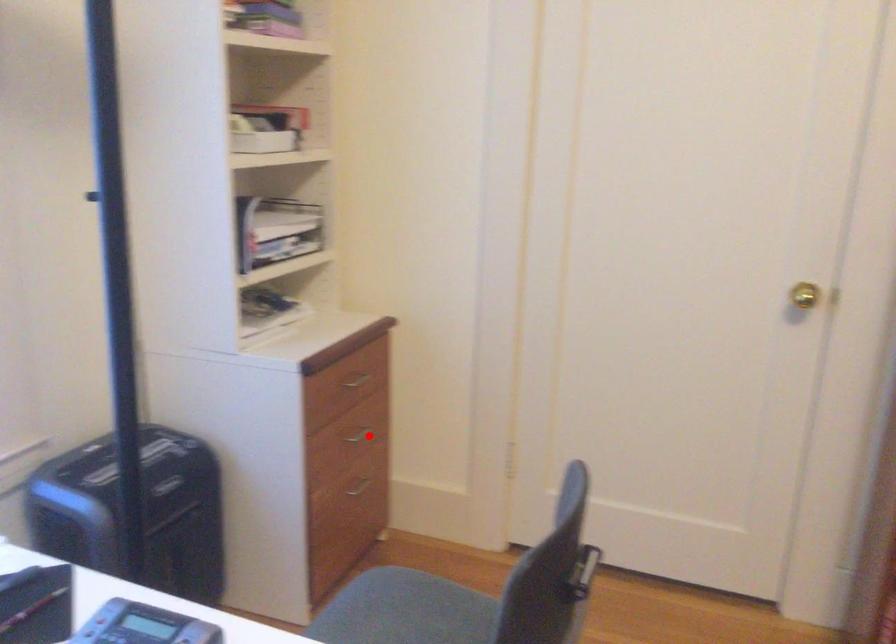
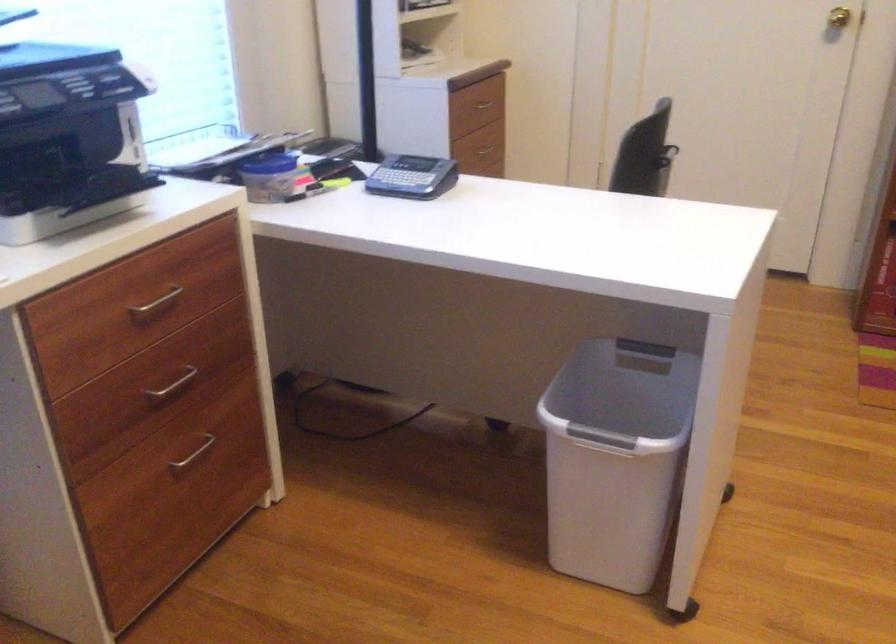
The point at the highlighted location is marked in the first image. Where is the corresponding point in the second image?

(486, 149)